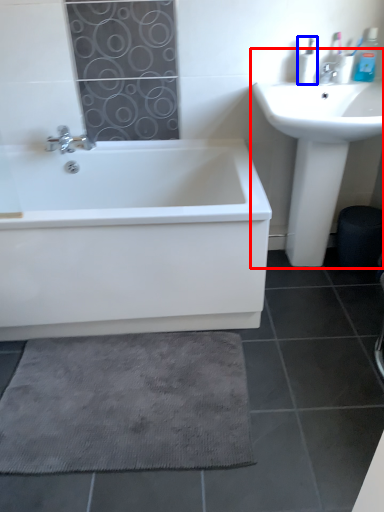
Question: Which of the following is the farthest to the observer, sink (highlighted by a red box) or toiletry (highlighted by a blue box)?

Choices:
 (A) sink
 (B) toiletry

Answer: (B)